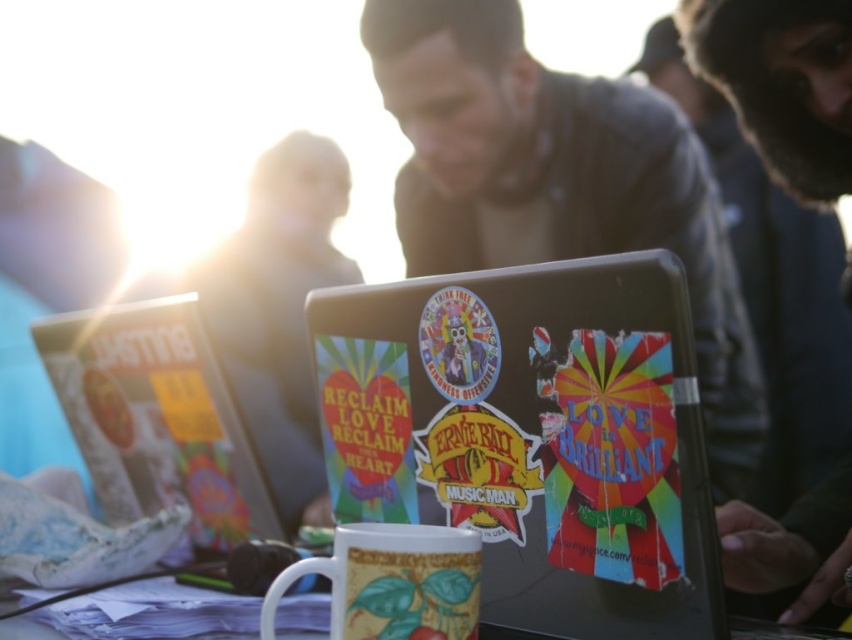
Who is shorter, multicolored stickered laptop at center or white glossy mug at lower center?

white glossy mug at lower center is shorter.

Does multicolored stickered laptop at center have a larger size compared to white glossy mug at lower center?

Correct, multicolored stickered laptop at center is larger in size than white glossy mug at lower center.

Between point (706, 550) and point (229, 561), which one is positioned in front?

Point (706, 550) is in front.

Where is `multicolored stickered laptop at center`? multicolored stickered laptop at center is located at coordinates coord(533,436).

Looking at this image, is matte black laptop at center closer to the viewer compared to white glossy mug at center?

No, it is behind white glossy mug at center.

Is matte black laptop at center to the right of white glossy mug at center from the viewer's perspective?

Correct, you'll find matte black laptop at center to the right of white glossy mug at center.

Is point (700, 168) behind point (363, 605)?

Yes.

The image size is (852, 640). What are the coordinates of `matte black laptop at center` in the screenshot? It's located at (559, 184).

The width and height of the screenshot is (852, 640). I want to click on multicolored stickered laptop at center, so tap(533, 436).

Between multicolored stickered laptop at center and white glossy mug at center, which one appears on the right side from the viewer's perspective?

multicolored stickered laptop at center

Find the location of a particular element. multicolored stickered laptop at center is located at coordinates (533, 436).